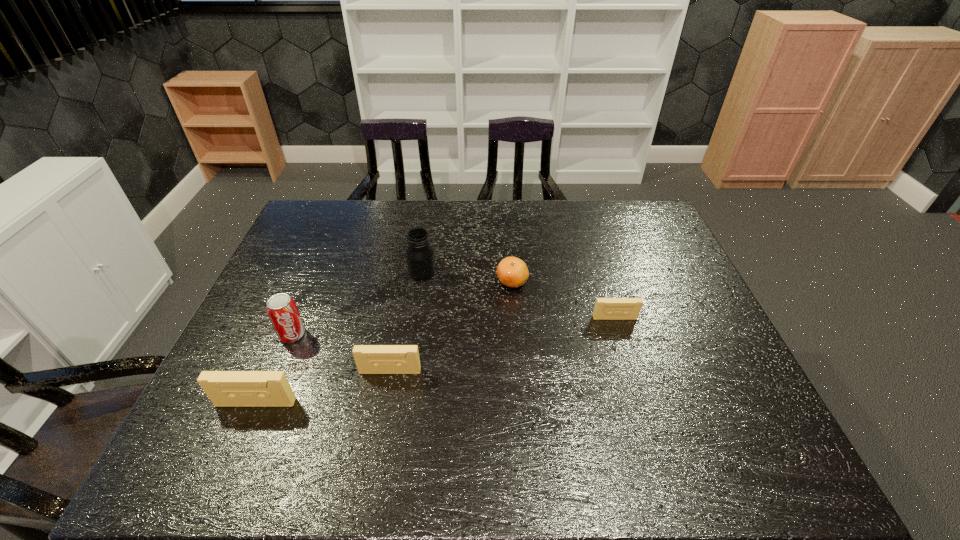
Identify the location of vacant region located at the front of the second tallest videotape with spools. This screenshot has height=540, width=960. (382, 416).

Locate an element on the screen. vacant area situated at the front of the rightmost videotape with spools is located at coordinates (633, 376).

You are a GUI agent. You are given a task and a screenshot of the screen. Output one action in this format:
    pyautogui.click(x=<x>, y=<y>)
    Task: Click on the blank space located on the back of the soda can
    This screenshot has width=960, height=540.
    Given the screenshot: What is the action you would take?
    pyautogui.click(x=314, y=282)

You are a GUI agent. You are given a task and a screenshot of the screen. Output one action in this format:
    pyautogui.click(x=<x>, y=<y>)
    Task: Click on the vacant space located on the left of the fifth object from left to right
    
    Given the screenshot: What is the action you would take?
    pyautogui.click(x=423, y=281)

This screenshot has height=540, width=960. Find the location of `free location located on the front of the jar`. free location located on the front of the jar is located at coordinates (410, 352).

Where is `object positioned at the near edge`? Image resolution: width=960 pixels, height=540 pixels. object positioned at the near edge is located at coordinates (224, 388).

Identify the location of videotape that is at the left edge. (224, 388).

This screenshot has height=540, width=960. What are the coordinates of `soda can that is at the left edge` in the screenshot? It's located at (281, 308).

Image resolution: width=960 pixels, height=540 pixels. Identify the location of object located at the near left corner. (224, 388).

Find the location of a particular element. vacant space at the far edge of the desktop is located at coordinates (610, 213).